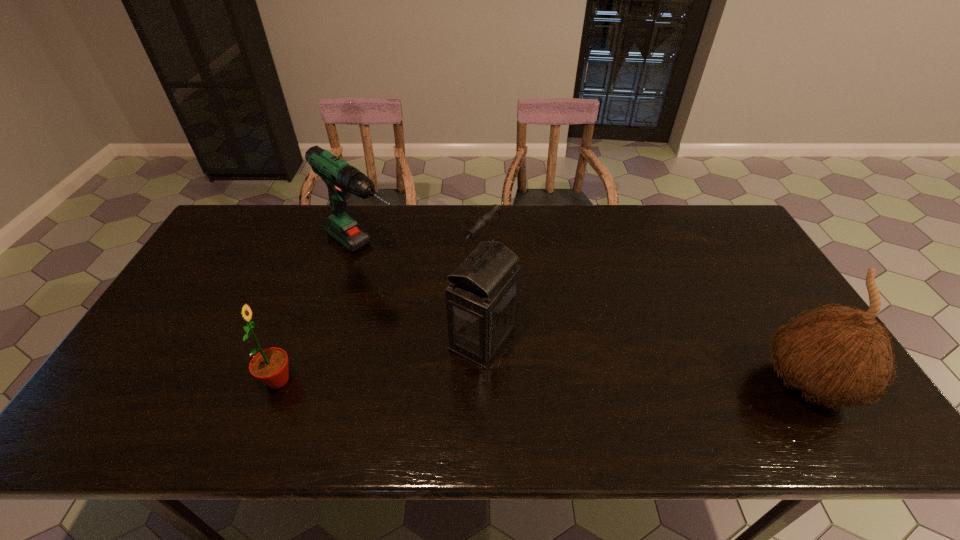
The width and height of the screenshot is (960, 540). Find the location of `sunflower`. sunflower is located at coordinates (270, 366).

You are a GUI agent. You are given a task and a screenshot of the screen. Output one action in this format:
    pyautogui.click(x=<x>, y=<y>)
    Task: Click on the coconut
    Image resolution: width=960 pixels, height=540 pixels.
    Given the screenshot: What is the action you would take?
    pyautogui.click(x=841, y=355)

Find the location of `the tallest object`. the tallest object is located at coordinates (481, 299).

Where is `lantern`? lantern is located at coordinates click(481, 299).

Identify the location of the farthest object. (x=341, y=178).

You are a GUI agent. You are given a task and a screenshot of the screen. Output one action in this format:
    pyautogui.click(x=<x>, y=<y>)
    Task: Click on the free spot located 0.300m on the face of the sunflower
    The width and height of the screenshot is (960, 540).
    Given the screenshot: What is the action you would take?
    pyautogui.click(x=420, y=380)

In order to click on vacant space positioned 0.210m on the front-facing side of the lantern in this screenshot , I will do pos(590,393).

Where is `vacant area situated 0.160m on the front-facing side of the lantern`? vacant area situated 0.160m on the front-facing side of the lantern is located at coordinates (570, 383).

The image size is (960, 540). In order to click on vacant area situated 0.220m on the front-facing side of the lantern in this screenshot , I will do tap(594, 394).

You are a GUI agent. You are given a task and a screenshot of the screen. Output one action in this format:
    pyautogui.click(x=<x>, y=<y>)
    Task: Click on the vacant region located on the handle side of the drill
    The height and width of the screenshot is (540, 960).
    Given the screenshot: What is the action you would take?
    pyautogui.click(x=414, y=289)